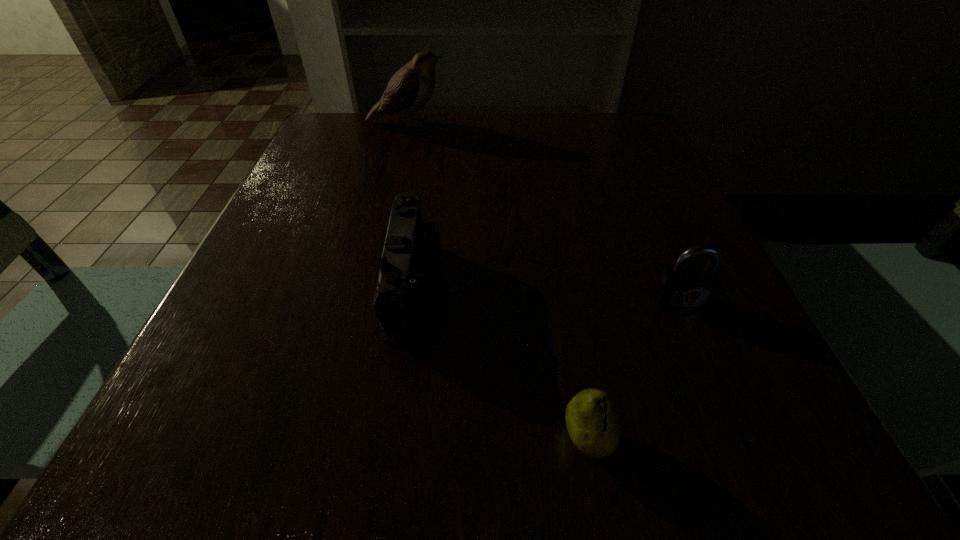
You are a GUI agent. You are given a task and a screenshot of the screen. Output one action in this format:
    pyautogui.click(x=<x>, y=<y>)
    Task: Click on the object at the far edge
    The image size is (960, 540).
    Given the screenshot: What is the action you would take?
    pyautogui.click(x=410, y=88)

Where is `object located at the near edge`? This screenshot has width=960, height=540. object located at the near edge is located at coordinates (593, 421).

At what (x,y) coordinates should I click in order to perform the action: click on object positioned at the left edge. Please return your answer as a coordinate pair (x, y). This screenshot has width=960, height=540. Looking at the image, I should click on (410, 88).

Identify the location of object present at the right edge. The height and width of the screenshot is (540, 960). (681, 286).

This screenshot has height=540, width=960. What are the coordinates of `object located in the far left corner section of the desktop` in the screenshot? It's located at (410, 88).

Where is `vacant point at the far edge`? This screenshot has width=960, height=540. vacant point at the far edge is located at coordinates tap(389, 120).

This screenshot has width=960, height=540. Find the location of `vacant space at the near edge of the desktop`. vacant space at the near edge of the desktop is located at coordinates (361, 446).

Locate an element on the screen. The image size is (960, 540). free space at the left edge of the desktop is located at coordinates tap(319, 254).

The width and height of the screenshot is (960, 540). What are the coordinates of `vacant space at the right edge` in the screenshot? It's located at (639, 212).

In the image, there is a desktop. At what (x,y) coordinates should I click in order to perform the action: click on vacant space at the far left corner. Please return your answer as a coordinate pair (x, y). This screenshot has height=540, width=960. Looking at the image, I should click on (376, 140).